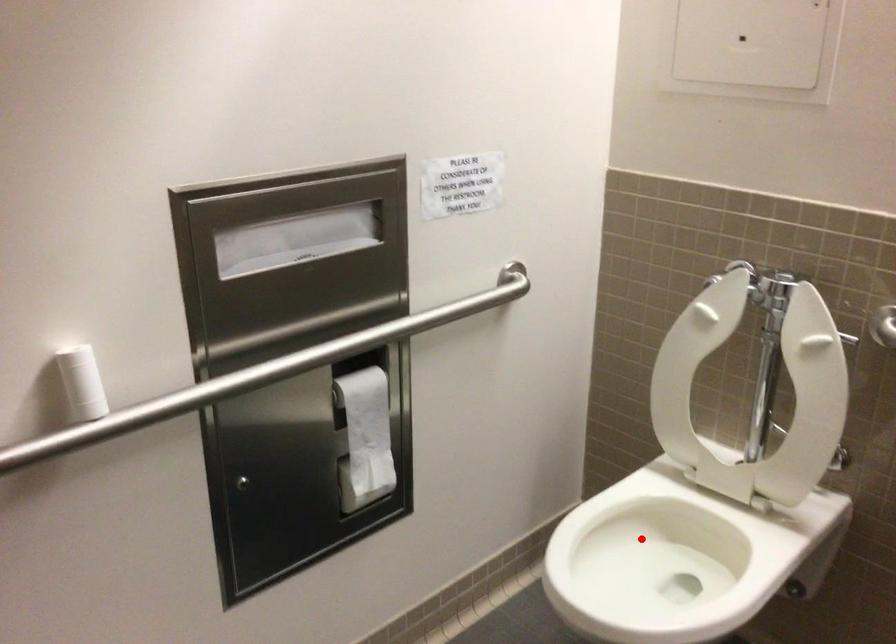
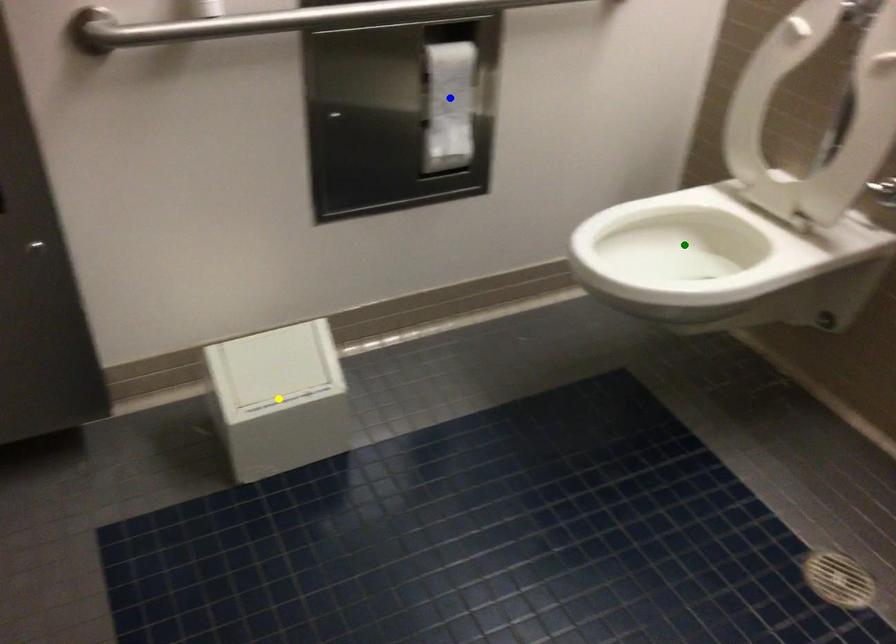
Question: I am providing you with two images of the same scene from different viewpoints. A red point is marked on the first image. You are given multiple points on the second image. Which point in image 2 represents the same 3d spot as the red point in image 1?

Choices:
 (A) green point
 (B) yellow point
 (C) blue point

Answer: (A)